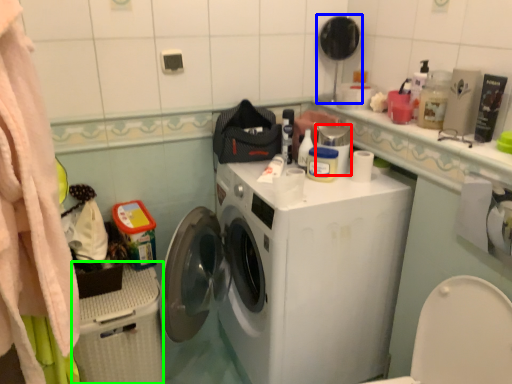
Question: Which object is positioned closest to appliance (highlighted by a red box)? Select from mirror (highlighted by a blue box) and dish washer (highlighted by a green box).

Choices:
 (A) mirror
 (B) dish washer

Answer: (A)